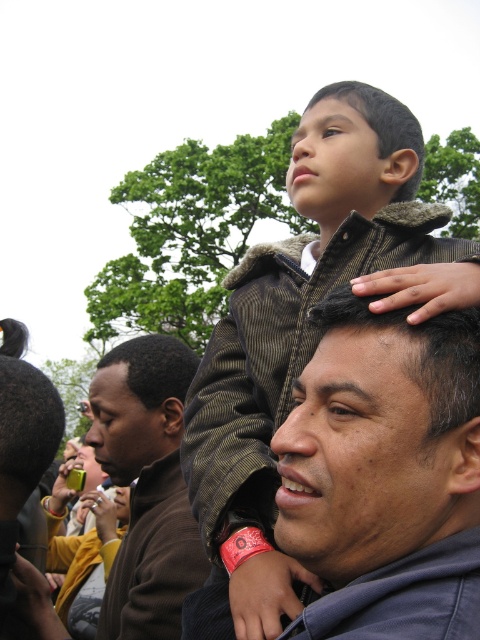
You are standing in the outdoor gathering scene. You see two points marked in the image. The first point is at coordinate point (132, 536) and the second point is at coordinate point (338, 168). Which point is closer to you?

Point (132, 536) is closer to you because it is further to the viewer than point (338, 168).

You are a clothing designer observing this outdoor gathering. You need to determine which jacket, the brown fleece jacket at left or the brown fuzzy jacket at upper center, would be more suitable for a colder winter day based on their sizes. Which one would you recommend and why?

The brown fleece jacket at left is bigger than the brown fuzzy jacket at upper center, so it would provide more insulation and warmth, making it more suitable for a colder winter day.

Looking at this image, you are a photographer trying to capture a candid shot of the dark brown hair at center and the brown fuzzy jacket at upper center. Based on their positions, which object is closer to the right side of the frame?

The dark brown hair at center is closer to the right side of the frame because it is positioned to the right of the brown fuzzy jacket at upper center.